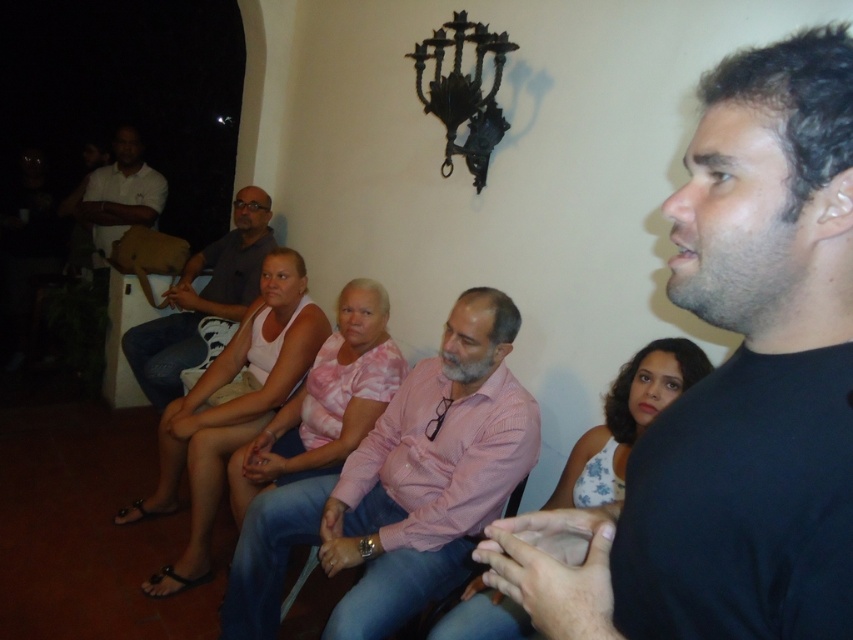
Between black matte shirt at center and pink striped shirt at center, which one is positioned higher?

Positioned higher is black matte shirt at center.

How distant is black matte shirt at center from pink striped shirt at center?

black matte shirt at center and pink striped shirt at center are 3.95 feet apart.

The width and height of the screenshot is (853, 640). I want to click on black matte shirt at center, so click(x=732, y=388).

Can you confirm if matte gray shirt at center is wider than white matte shirt at upper left?

Yes.

Is matte gray shirt at center taller than white matte shirt at upper left?

Indeed, matte gray shirt at center has a greater height compared to white matte shirt at upper left.

This screenshot has width=853, height=640. What do you see at coordinates (202, 300) in the screenshot?
I see `matte gray shirt at center` at bounding box center [202, 300].

I want to click on matte gray shirt at center, so click(202, 300).

Does pink striped shirt at center appear on the left side of white matte shirt at upper left?

Incorrect, pink striped shirt at center is not on the left side of white matte shirt at upper left.

Does pink striped shirt at center have a lesser height compared to white matte shirt at upper left?

No.

This screenshot has height=640, width=853. I want to click on pink striped shirt at center, so click(x=399, y=486).

Locate an element on the screen. The width and height of the screenshot is (853, 640). pink striped shirt at center is located at coordinates (399, 486).